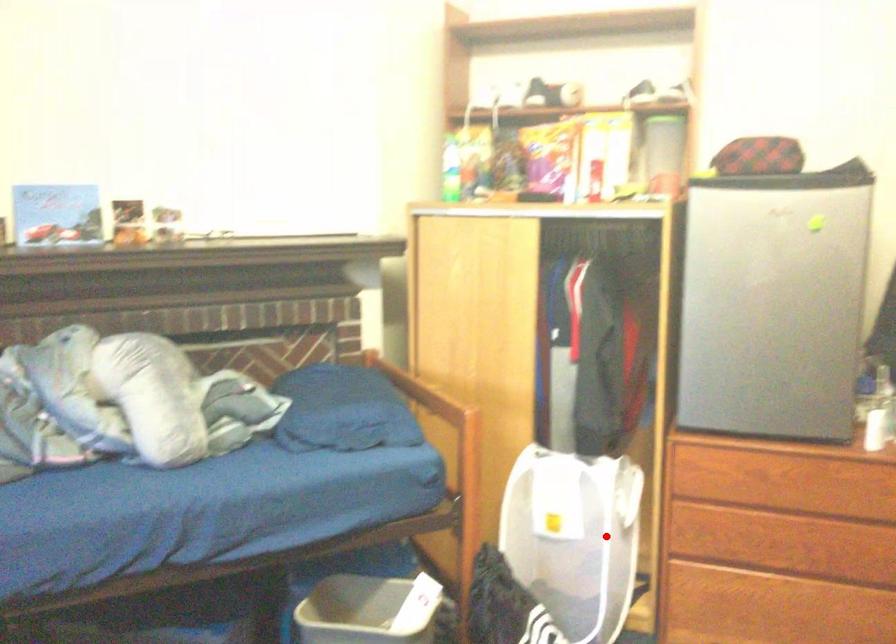
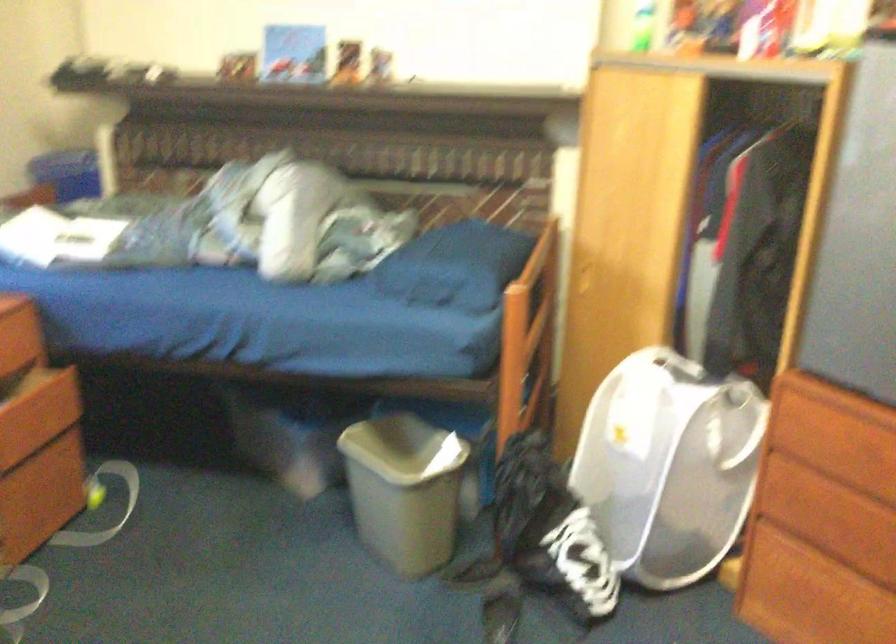
Question: I am providing you with two images of the same scene from different viewpoints. Image1 has a red point marked. In image2, the corresponding 3D location appears at what relative position? Reply with the corresponding letter.

Choices:
 (A) Closer
 (B) Farther

Answer: (A)